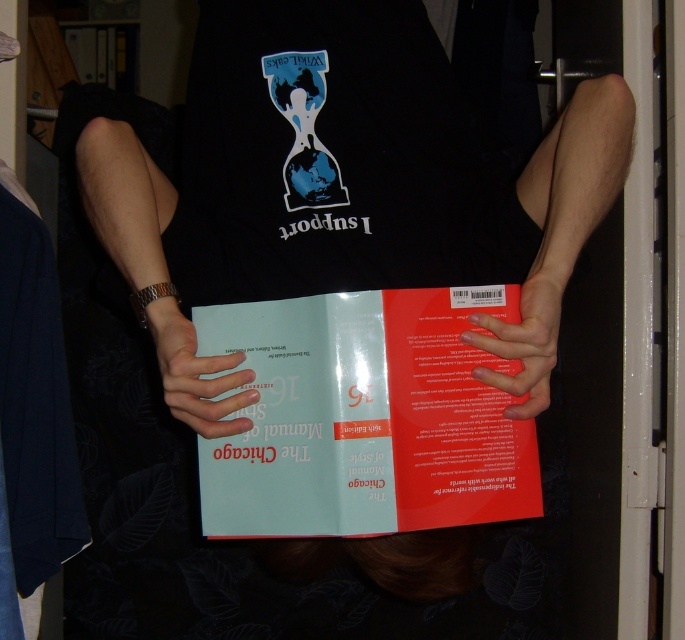
You are a delivery robot that is 8 inches wide. You need to pass through a narrow gap between the white matte paper at center and the smooth matte skin at center. Can you fit through the gap?

The distance between the white matte paper at center and the smooth matte skin at center is 10.21 inches, so the robot can fit through the gap since it is wider than the robot.

You are a photographer taking a picture of the scene. The white matte paper at center and smooth matte skin at center are both in your viewfinder. Which object is closer to the camera?

The white matte paper at center is closer to the camera because the smooth matte skin at center is behind it.